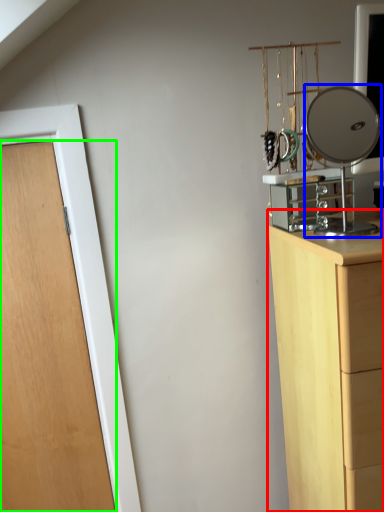
Question: Considering the real-world distances, which object is farthest from chest of drawers (highlighted by a red box)? mirror (highlighted by a blue box) or door (highlighted by a green box)?

Choices:
 (A) mirror
 (B) door

Answer: (A)